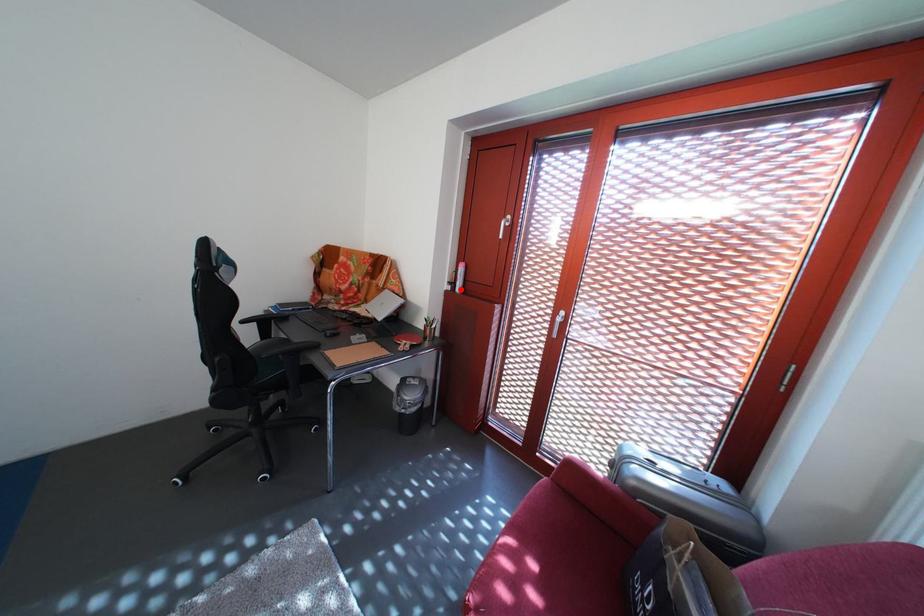
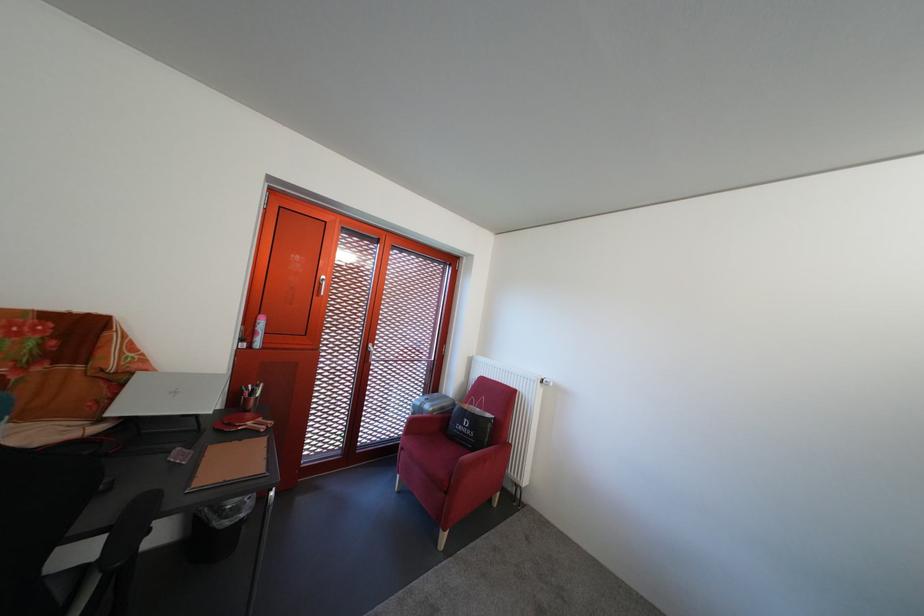
Find the pixel in the second image that matches the highlighted location in the first image.

(252, 346)